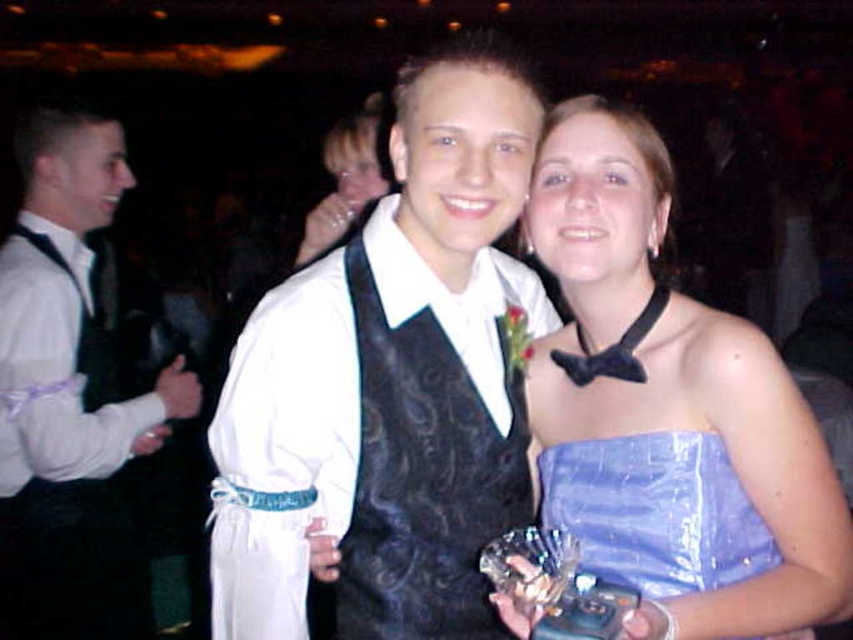
You are a photographer at the event and want to adjust the lighting so that the black satin vest at center and the black satin bow tie at upper center are both clearly visible. Since they are both black, how can you ensure the vest and bow tie are distinguishable in the photo?

The black satin vest at center is in front of the black satin bow tie at upper center, so adjusting the lighting to highlight the vest slightly more will make the bow tie appear slightly behind it, creating depth and distinction between the two.

Based on the photo, you are a photographer at the event and want to ensure both the shiny blue fabric dress at center and the black satin bow tie at upper center are clearly visible in your photo. Given their sizes, which one might require you to adjust your camera focus more carefully to avoid blurring?

The black satin bow tie at upper center requires more careful focus adjustment because it is smaller in size compared to the shiny blue fabric dress at center.

You are a photographer at this event and need to adjust the lighting to ensure both the white satin vest at left and the satin blue dress at center are equally visible. Given their sizes, which one might require more focused lighting?

The white satin vest at left is larger in size than the satin blue dress at center, so it might require more focused lighting to ensure both are equally visible.